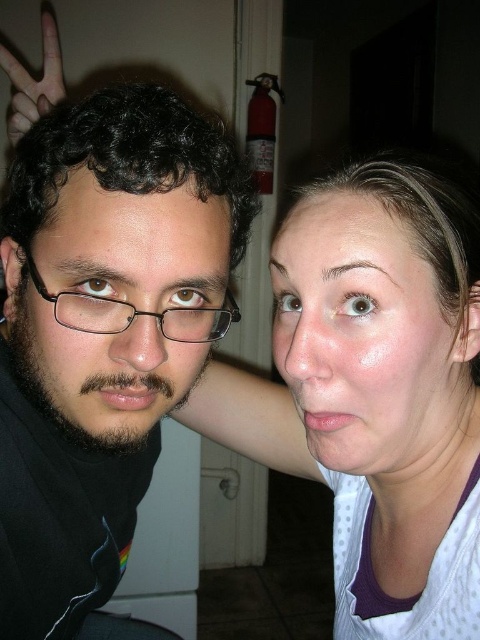
You are standing in the room and want to reach the point marked as point [459,580]. If your arm can extend 16 inches, can you touch that point without moving your feet?

The distance between you and point [459,580] is 18.34 inches. Since your arm can only extend 16 inches, you cannot touch it without moving your feet.

You are trying to determine if the black matte glasses at left can completely cover the matte black face at left. Based on their sizes, what is your conclusion?

The black matte glasses at left is bigger than the matte black face at left, so it can completely cover the matte black face at left.